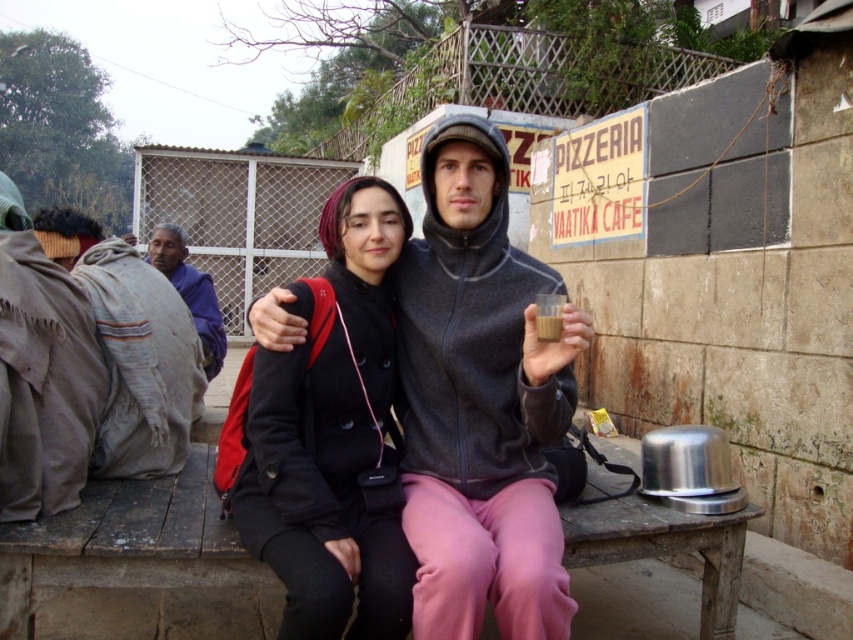
You are a delivery person who needs to place a small package between the black matte coat at center and the brown woolen blanket at left. Can you fit it there?

The distance between the black matte coat at center and the brown woolen blanket at left is 1.24 meters, so yes, the package can be placed there since it has enough space.

You are a delivery person who needs to place a small package between the black matte coat at center and the purple fabric at left. The package requires a minimum of 4 meters of space. Can you fit it there?

The distance between the black matte coat at center and the purple fabric at left is 3.73 meters, which is less than the required 4 meters. Therefore, the package cannot be placed there.

You are a photographer trying to capture the black matte coat at center and the brown woolen blanket at left in a single shot. Since you want the blanket to be visible, should you adjust your camera focus to include more of the background or foreground?

The black matte coat at center is in front of the brown woolen blanket at left. To ensure the blanket is visible, you should adjust your camera focus to include more of the background where the blanket is located.